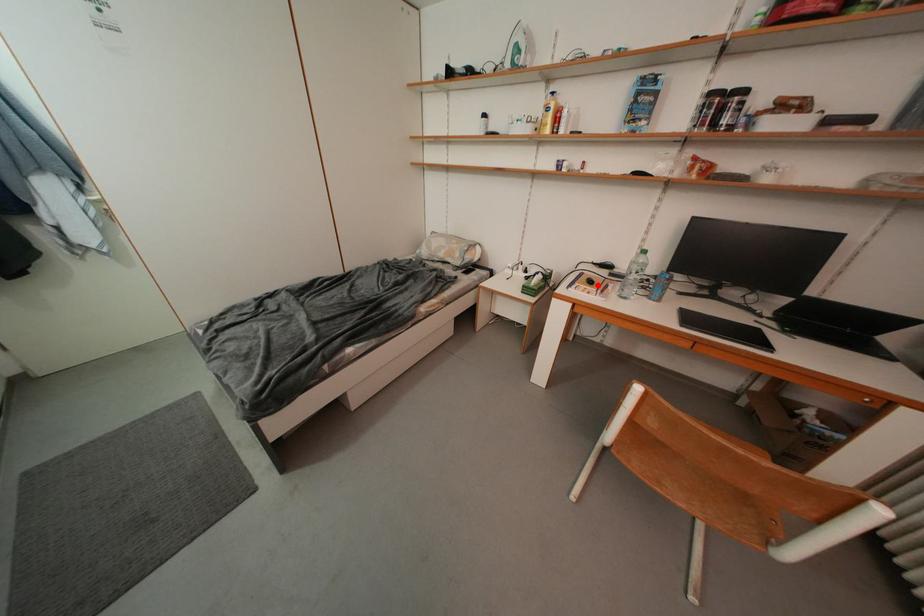
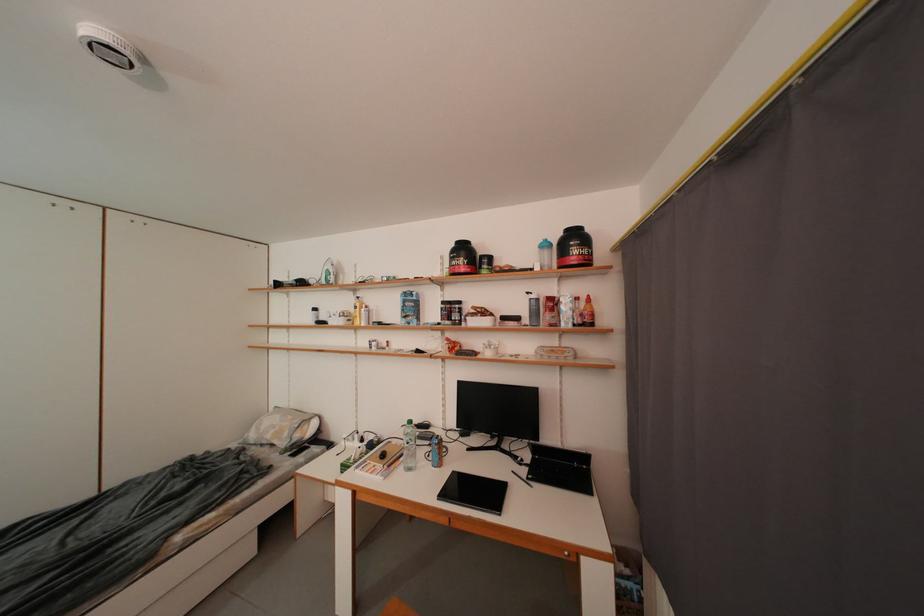
Question: I am providing you with two images of the same scene from different viewpoints. Given a red point in image1, look at the same physical point in image2. Is it:

Choices:
 (A) Closer to the viewpoint
 (B) Farther from the viewpoint

Answer: (B)